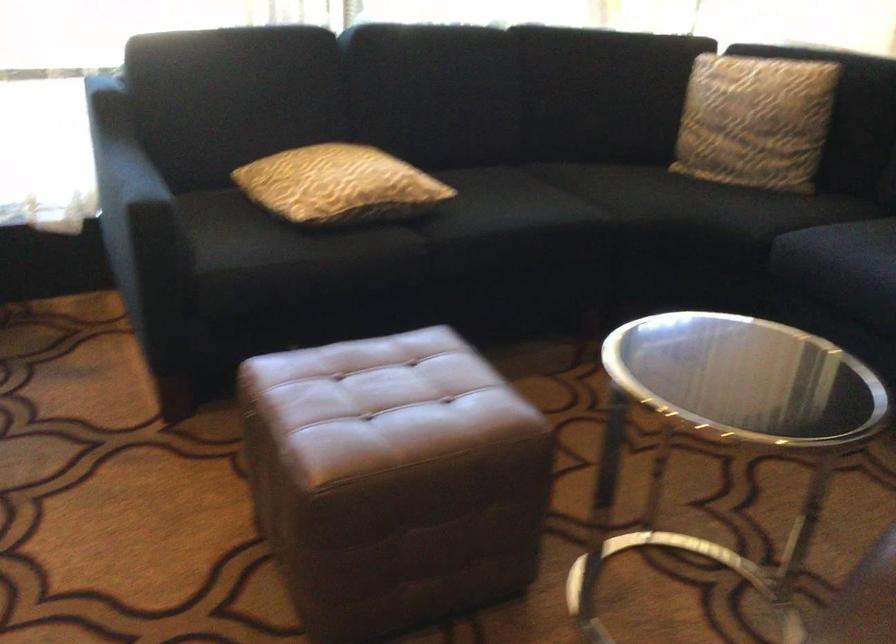
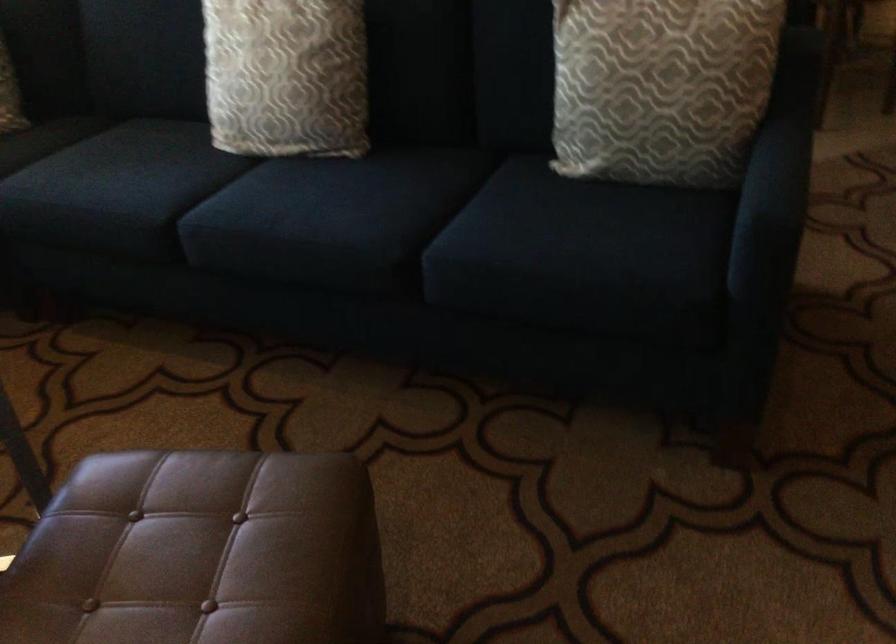
Question: Based on the continuous images, in which direction is the camera rotating? Reply with the corresponding letter.

Choices:
 (A) Left
 (B) Right
 (C) Up
 (D) Down

Answer: (B)